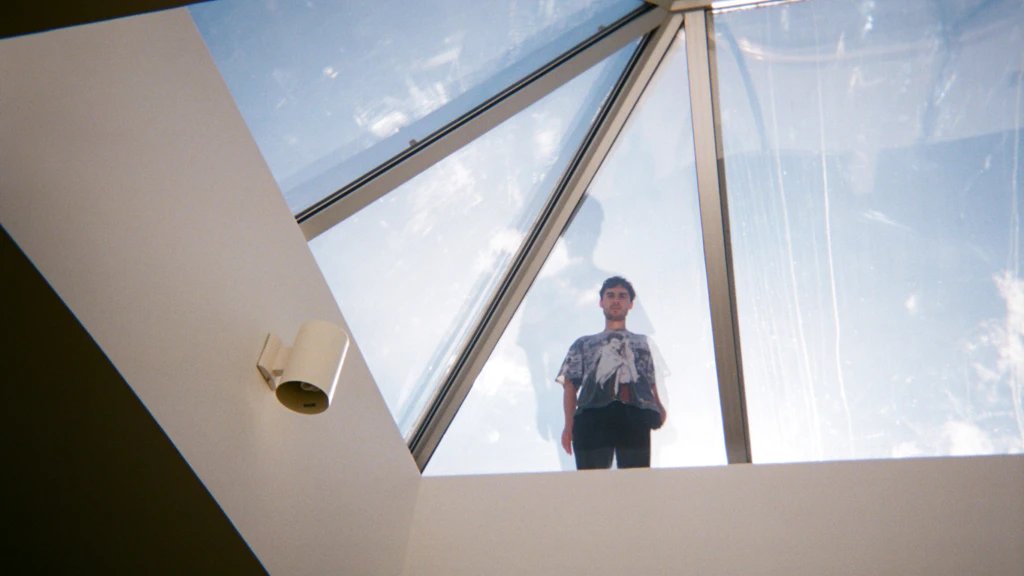
The width and height of the screenshot is (1024, 576). Find the location of `sconce`. sconce is located at coordinates (319, 341).